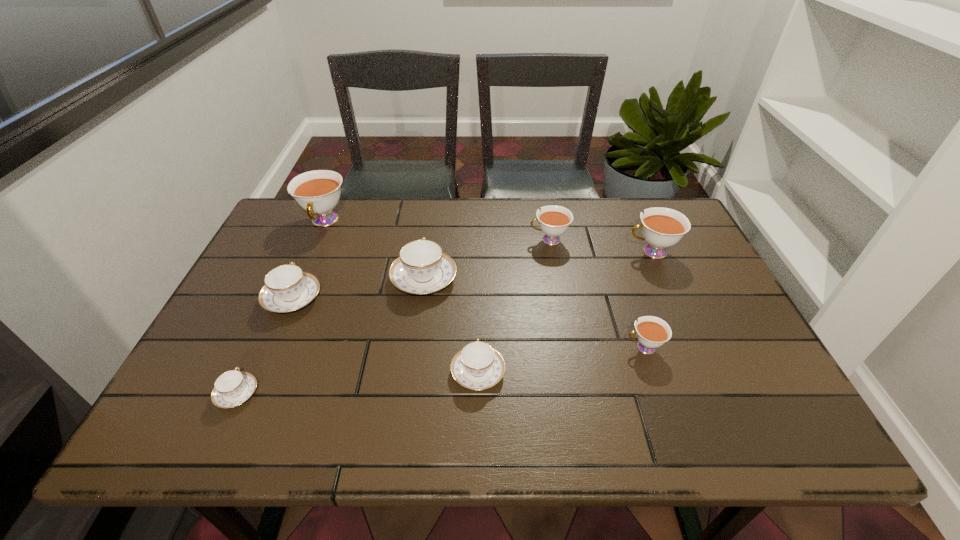
The width and height of the screenshot is (960, 540). What are the coordinates of `empty space that is in between the biggest blue teacup and the third biggest blue teacup` in the screenshot? It's located at (451, 326).

The image size is (960, 540). Find the location of `free spot between the second biggest white teacup and the third biggest blue teacup`. free spot between the second biggest white teacup and the third biggest blue teacup is located at coordinates (564, 312).

Locate an element on the screen. free space between the leftmost white teacup and the third object from right to left is located at coordinates (437, 231).

Where is `vacant space that's between the shortest teacup and the nearest white teacup`? Image resolution: width=960 pixels, height=540 pixels. vacant space that's between the shortest teacup and the nearest white teacup is located at coordinates (441, 370).

You are a GUI agent. You are given a task and a screenshot of the screen. Output one action in this format:
    pyautogui.click(x=<x>, y=<y>)
    Task: Click on the free space between the shortest object and the third smallest blue teacup
    The image size is (960, 540).
    Given the screenshot: What is the action you would take?
    pyautogui.click(x=265, y=346)

Identify which object is the second nearest to the second smallest blue teacup. Please provide its 2D coordinates. Your answer should be formatted as a tuple, i.e. [(x, y)], where the tuple contains the x and y coordinates of a point satisfying the conditions above.

[(652, 332)]

Identify which object is located as the third nearest to the smallest white teacup. Please provide its 2D coordinates. Your answer should be formatted as a tuple, i.e. [(x, y)], where the tuple contains the x and y coordinates of a point satisfying the conditions above.

[(554, 220)]

Choose which teacup is the sixth nearest neighbor to the biggest blue teacup. Please provide its 2D coordinates. Your answer should be formatted as a tuple, i.e. [(x, y)], where the tuple contains the x and y coordinates of a point satisfying the conditions above.

[(652, 332)]

Identify which teacup is located as the fourth nearest to the third teacup from right to left. Please provide its 2D coordinates. Your answer should be formatted as a tuple, i.e. [(x, y)], where the tuple contains the x and y coordinates of a point satisfying the conditions above.

[(477, 366)]

What are the coordinates of `white teacup object that ranks as the second closest to the leftmost white teacup` in the screenshot? It's located at (652, 332).